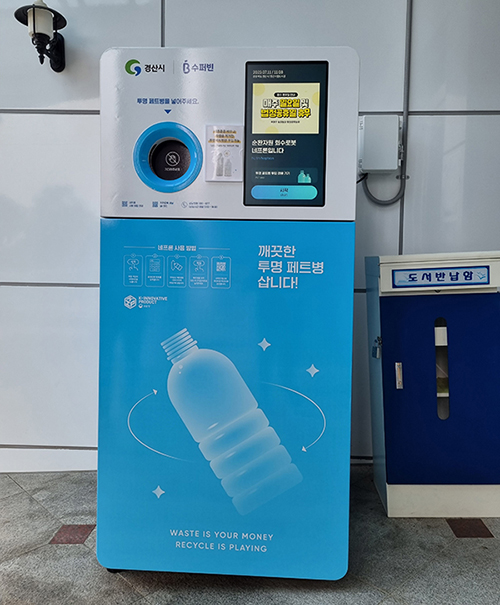
At what (x,y) coordinates should I click in order to perform the action: click on wall lantern. Please return your answer as a coordinate pair (x, y). The width and height of the screenshot is (500, 605). Looking at the image, I should click on pos(38,21).